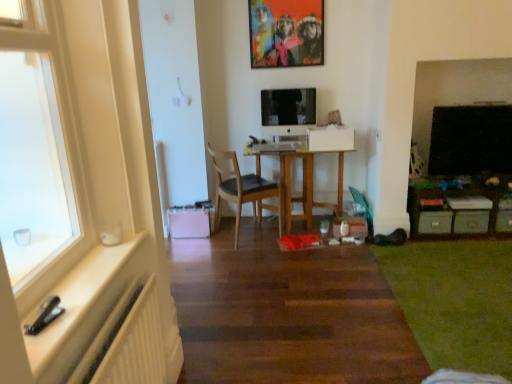
You are a GUI agent. You are given a task and a screenshot of the screen. Output one action in this format:
    pyautogui.click(x=<x>, y=<y>)
    Task: Click on the vacant space in wooden chair at center (from a real-world perspective)
    The height and width of the screenshot is (384, 512).
    Given the screenshot: What is the action you would take?
    pyautogui.click(x=239, y=235)